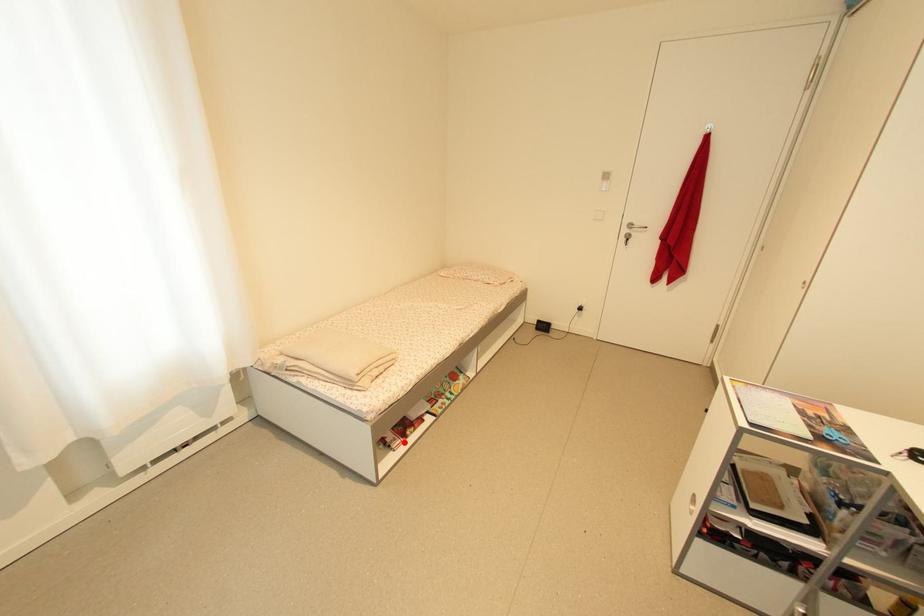
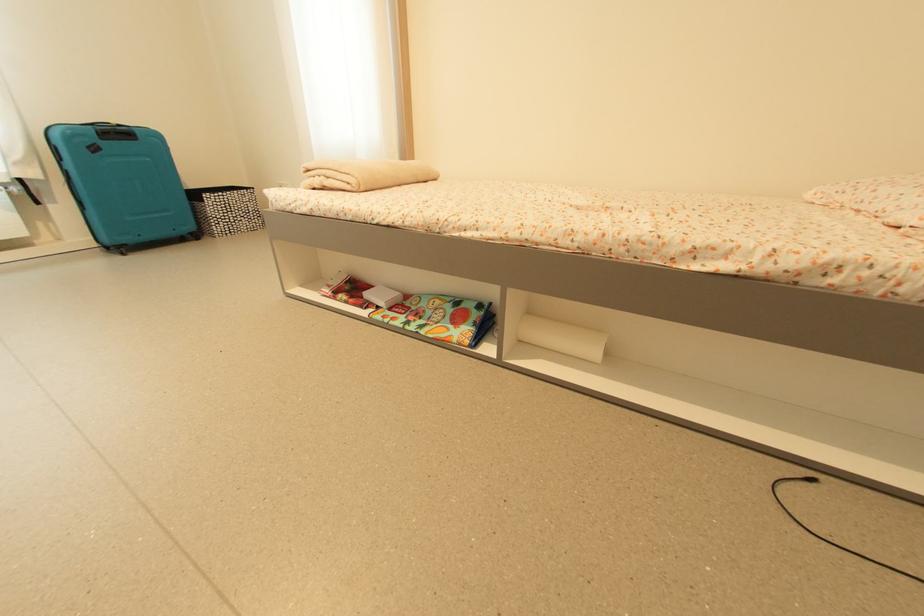
The point at the highlighted location is marked in the first image. Where is the corresponding point in the second image?

(333, 293)